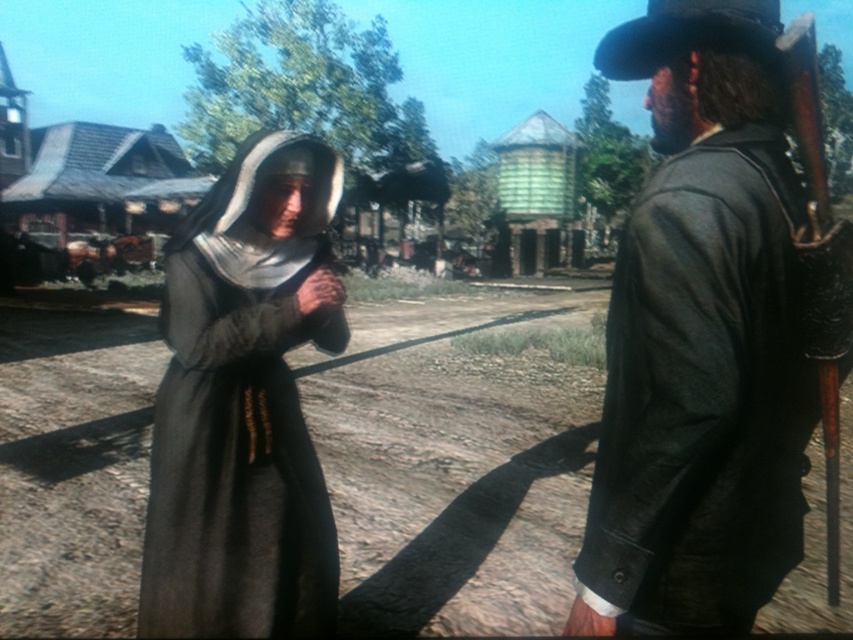
Question: Does leather jacket at right have a greater width compared to black felt cowboy hat at upper right?

Choices:
 (A) no
 (B) yes

Answer: (B)

Question: In this image, where is gray woolen robe at center located relative to black felt cowboy hat at upper right?

Choices:
 (A) above
 (B) below

Answer: (B)

Question: Is leather jacket at right further to camera compared to gray woolen robe at center?

Choices:
 (A) yes
 (B) no

Answer: (B)

Question: Which point appears closest to the camera in this image?

Choices:
 (A) (302, 300)
 (B) (744, 10)

Answer: (B)

Question: Which object is farther from the camera taking this photo?

Choices:
 (A) gray woolen robe at center
 (B) black felt cowboy hat at upper right
 (C) leather jacket at right

Answer: (A)

Question: Among these points, which one is nearest to the camera?

Choices:
 (A) (633, 29)
 (B) (679, 611)

Answer: (B)